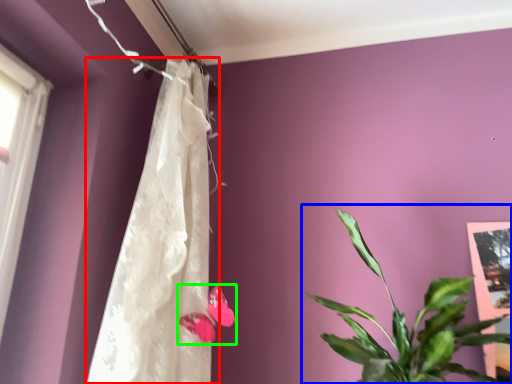
Question: Which object is positioned closest to curtain (highlighted by a red box)? Select from houseplant (highlighted by a blue box) and flower (highlighted by a green box).

Choices:
 (A) houseplant
 (B) flower

Answer: (B)